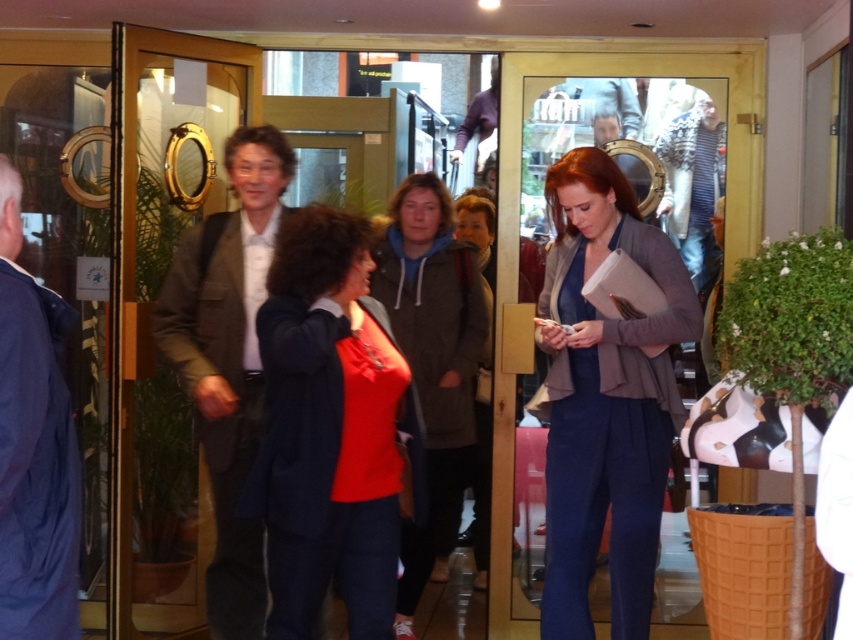
Question: Is blue woolen suit at center to the left of gray hoodie at center from the viewer's perspective?

Choices:
 (A) no
 (B) yes

Answer: (A)

Question: Is blue woolen suit at center wider than gray hoodie at center?

Choices:
 (A) yes
 (B) no

Answer: (A)

Question: Does clear glass door at center appear on the left side of gray hoodie at center?

Choices:
 (A) no
 (B) yes

Answer: (B)

Question: Among these points, which one is farthest from the camera?

Choices:
 (A) (474, 349)
 (B) (149, 600)
 (C) (614, 332)
 (D) (361, 412)

Answer: (A)

Question: Which point is closer to the camera?

Choices:
 (A) clear glass door at center
 (B) blue woolen suit at center
 (C) gray hoodie at center
 (D) matte red blouse at center

Answer: (D)

Question: Which object is closer to the camera taking this photo?

Choices:
 (A) gray hoodie at center
 (B) blue woolen suit at center

Answer: (B)